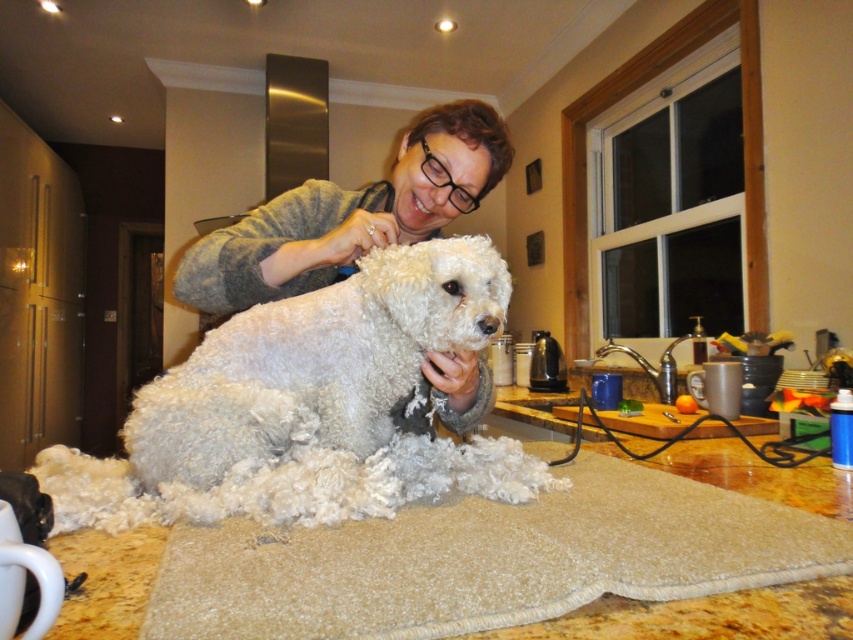
You are a delivery person who needs to place a 70 cm wide package on the kitchen counter. The package must be placed between the point at coordinates (169, 428) and another point. Can you fit the package between these two points?

The distance between the point at coordinates (169, 428) and the other point is 78.32 centimeters. Since the package is 70 cm wide, it can fit between these two points as 70 cm is less than 78.32 cm.

You are a photographer setting up a camera on the kitchen counter. You need to position the camera so it can capture both the beige carpet at lower center and the white fluffy dog at center clearly. Considering their heights, which object should be placed closer to the camera to ensure both are in focus?

The beige carpet at lower center has a lesser height compared to the white fluffy dog at center. To ensure both are in focus, the camera should be positioned closer to the beige carpet at lower center since it is shorter, allowing the dog to be in the background but still within the depth of field.

You are a home inspector evaluating this kitchen scene. You notice the white fluffy dog at center and the matte gray sweater at center. According to the spatial details, which object has a greater height?

The matte gray sweater at center is taller than the white fluffy dog at center.